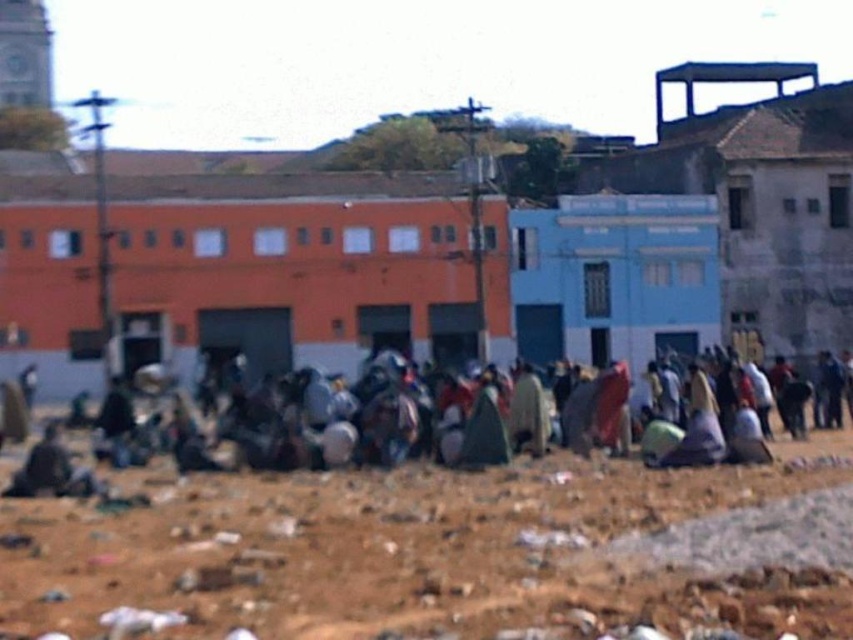
Question: Is brown sandy dirt at center above green fabric cloth at center?

Choices:
 (A) no
 (B) yes

Answer: (A)

Question: Which of the following is the farthest from the observer?

Choices:
 (A) brown sandy dirt at center
 (B) green fabric cloth at center

Answer: (B)

Question: Which point is farther to the camera?

Choices:
 (A) brown sandy dirt at center
 (B) green fabric cloth at center

Answer: (B)

Question: Which point appears farthest from the camera in this image?

Choices:
 (A) (300, 584)
 (B) (97, 470)

Answer: (B)

Question: Is brown sandy dirt at center closer to the viewer compared to green fabric cloth at center?

Choices:
 (A) yes
 (B) no

Answer: (A)

Question: Is brown sandy dirt at center to the right of green fabric cloth at center from the viewer's perspective?

Choices:
 (A) no
 (B) yes

Answer: (A)